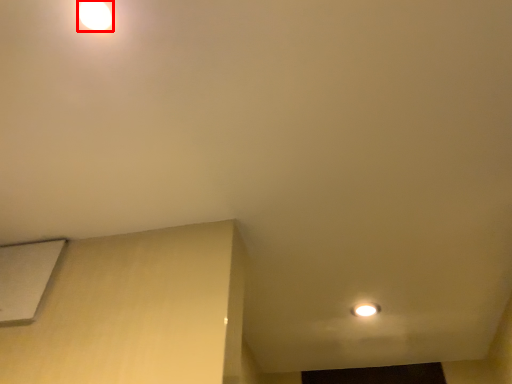
Question: From the image, what is the correct spatial relationship of lamp (annotated by the red box) in relation to lift?

Choices:
 (A) right
 (B) left

Answer: (A)